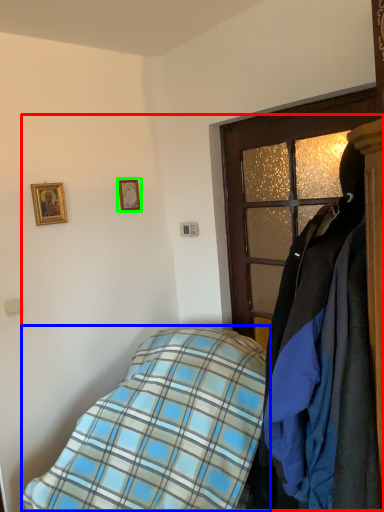
Question: Which object is positioned closest to bed (highlighted by a red box)? Select from bed (highlighted by a blue box) and picture frame (highlighted by a green box).

Choices:
 (A) bed
 (B) picture frame

Answer: (A)